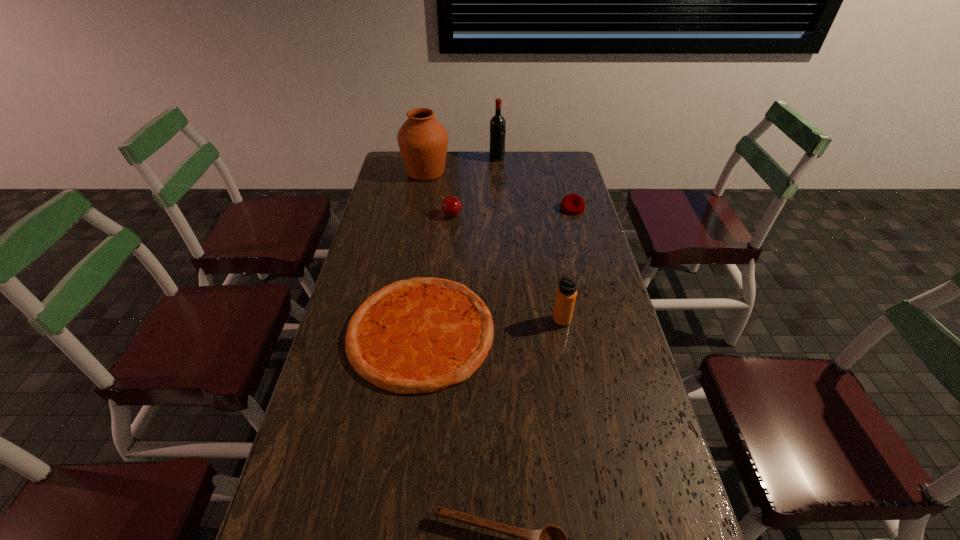
Locate an element on the screen. wine bottle is located at coordinates (497, 123).

You are a GUI agent. You are given a task and a screenshot of the screen. Output one action in this format:
    pyautogui.click(x=<x>, y=<y>)
    Task: Click on the urn
    
    Given the screenshot: What is the action you would take?
    pyautogui.click(x=423, y=140)

Where is `the third tallest object`? The width and height of the screenshot is (960, 540). the third tallest object is located at coordinates (566, 294).

This screenshot has height=540, width=960. I want to click on thermos bottle, so click(566, 294).

Locate an element on the screen. This screenshot has height=540, width=960. cherry is located at coordinates (451, 206).

At what (x,y) coordinates should I click in order to perform the action: click on the third shortest object. Please return your answer as a coordinate pair (x, y). The height and width of the screenshot is (540, 960). Looking at the image, I should click on (572, 204).

This screenshot has width=960, height=540. What are the coordinates of `the rightmost object` in the screenshot? It's located at (572, 204).

Locate an element on the screen. The image size is (960, 540). pizza is located at coordinates (421, 335).

Locate an element on the screen. This screenshot has width=960, height=540. vacant space situated on the left of the wine bottle is located at coordinates (426, 158).

This screenshot has width=960, height=540. I want to click on vacant space located 0.130m on the right of the urn, so click(478, 172).